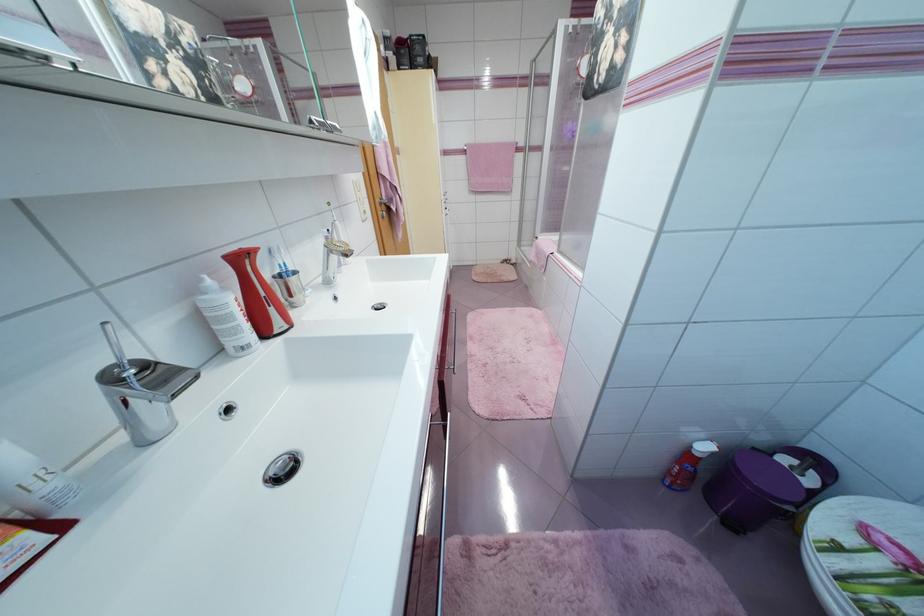
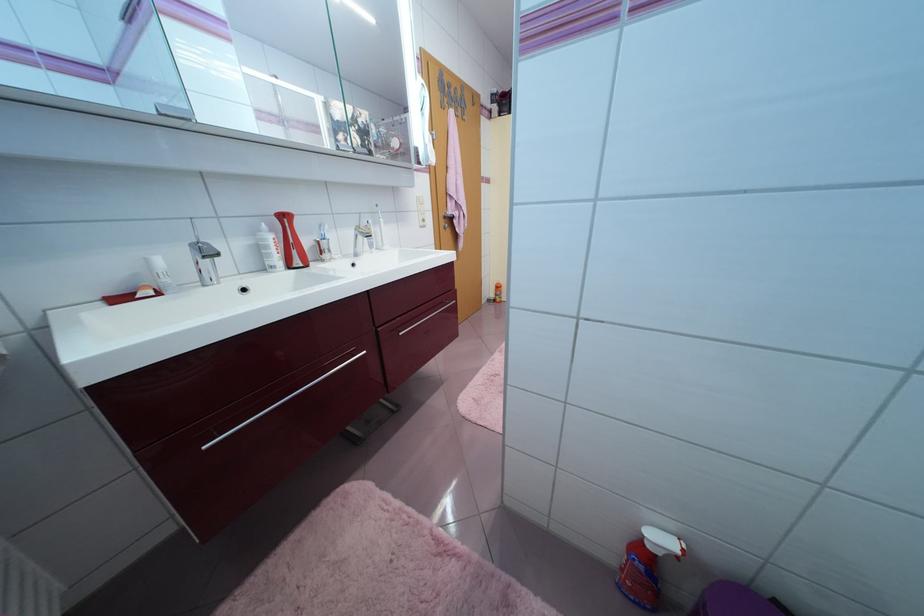
Locate, in the second image, the point that corresponds to point 282,333 in the first image.

(299, 267)